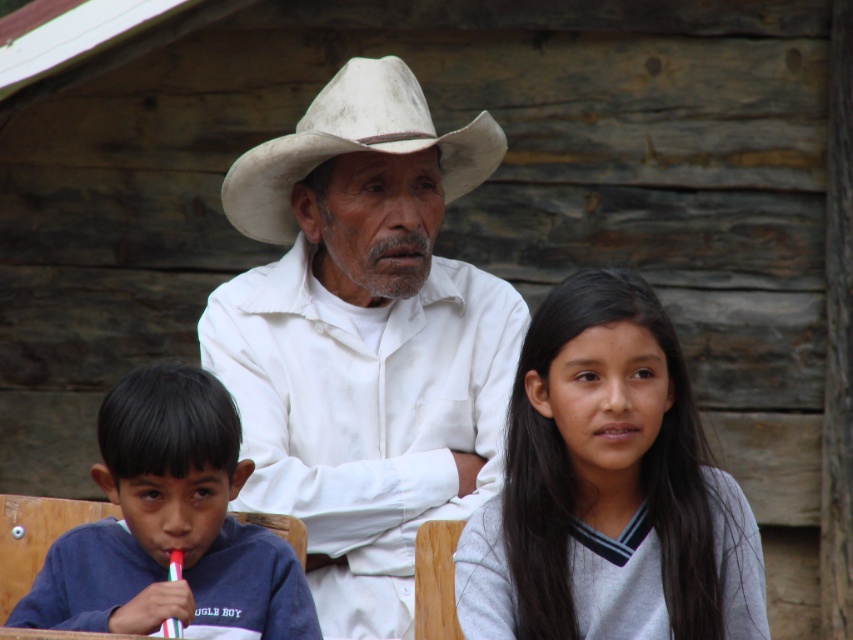
You are a photographer standing at a specific spot. You want to capture a clear photo of the gray matte sweater at center. What is the minimum distance you need to maintain from the camera to ensure the sweater is in focus?

The minimum distance you need to maintain from the camera to ensure the gray matte sweater at center is in focus is 10.57 feet, as that is the distance between them according to the description.

You are a photographer trying to capture a group photo of the white matte hat at center and the blue cotton shirt at lower left. To ensure both subjects are in focus, you need to know their relative positions. Which object is positioned to the right of the other?

The white matte hat at center is to the right of the blue cotton shirt at lower left.

You are trying to decide which item is easier to fold. You see the blue cotton shirt at lower left and the white felt cowboy hat at center. Which one is thinner?

The blue cotton shirt at lower left is thinner than the white felt cowboy hat at center, so it would be easier to fold.